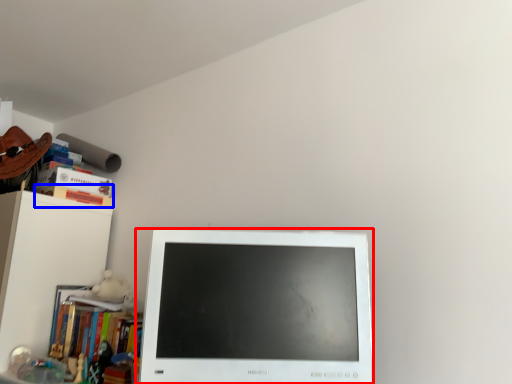
Question: Which object appears closest to the camera in this image, computer monitor (highlighted by a red box) or paperback book (highlighted by a blue box)?

Choices:
 (A) computer monitor
 (B) paperback book

Answer: (A)